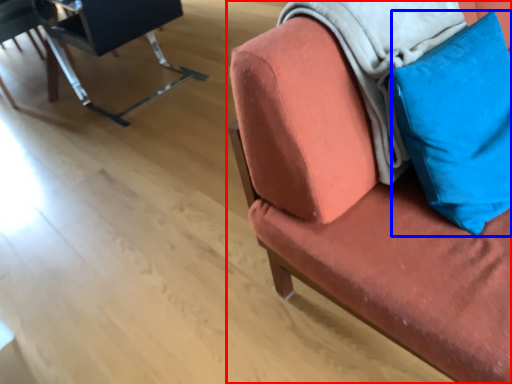
Question: Among these objects, which one is nearest to the camera, chair (highlighted by a red box) or pillow (highlighted by a blue box)?

Choices:
 (A) chair
 (B) pillow

Answer: (A)